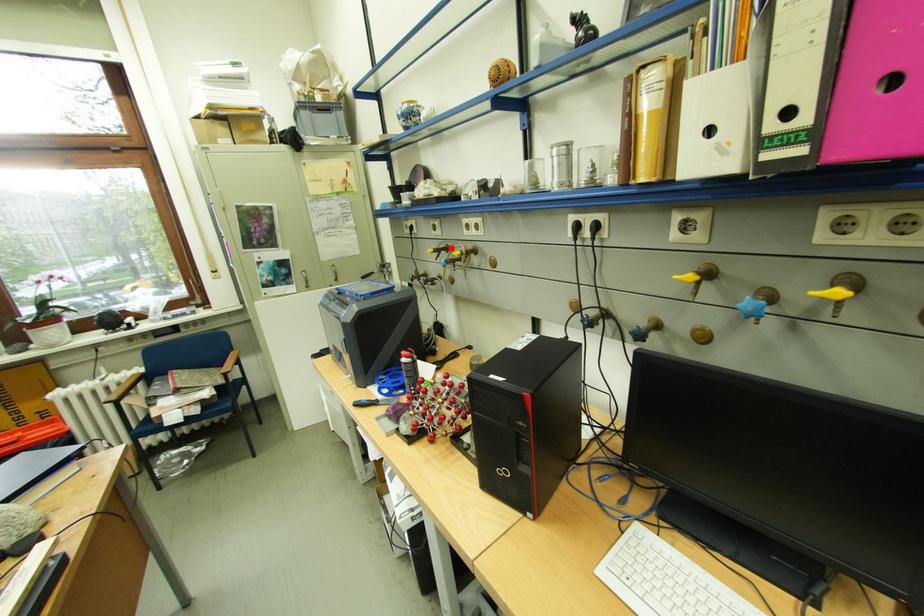
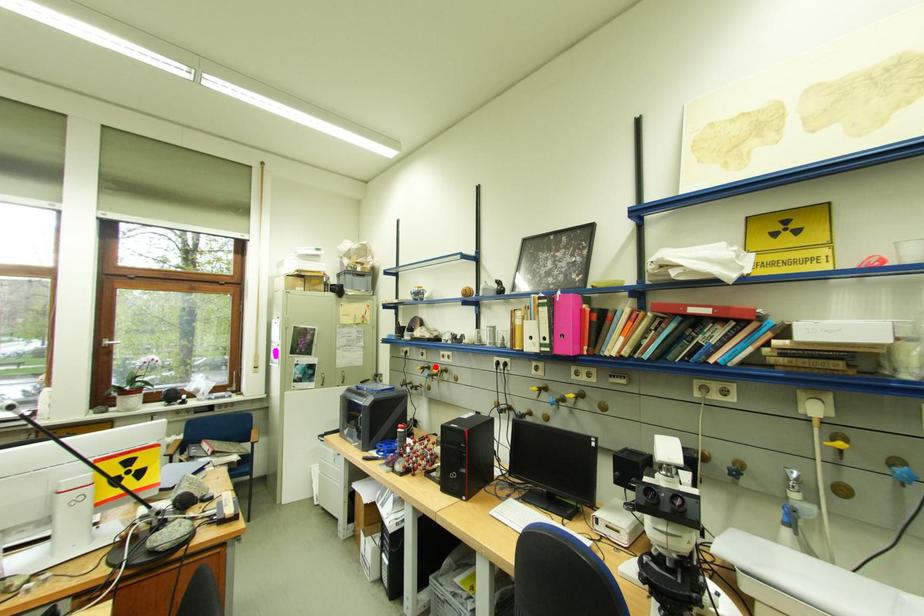
I am providing you with two images of the same scene from different viewpoints. A red point is marked on the first image and another point is marked on the second image. Is the marked point in image1 the same physical position as the marked point in image2?

Yes